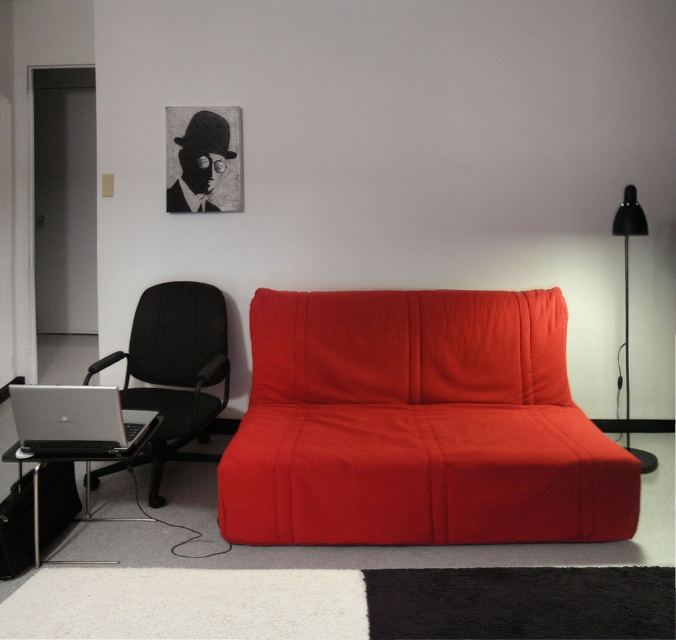
You are standing in the living room and want to move from the sofa to the office chair. There are two points marked on the floor at coordinates point [564,364] and point [646,472]. Which point is closer to the sofa?

Point [564,364] is closer to the sofa because it is behind point [646,472], meaning it is farther away from the sofa.

You are standing in the living room and see two points marked on the floor. The first point is at location point (x=160, y=401) and the second point is at point (x=28, y=385). If you walk towards the sofa, which point will you step on first?

The point at (x=160, y=401) is in front of the point at (x=28, y=385), so you will step on the point (x=160, y=401) first when walking towards the sofa.